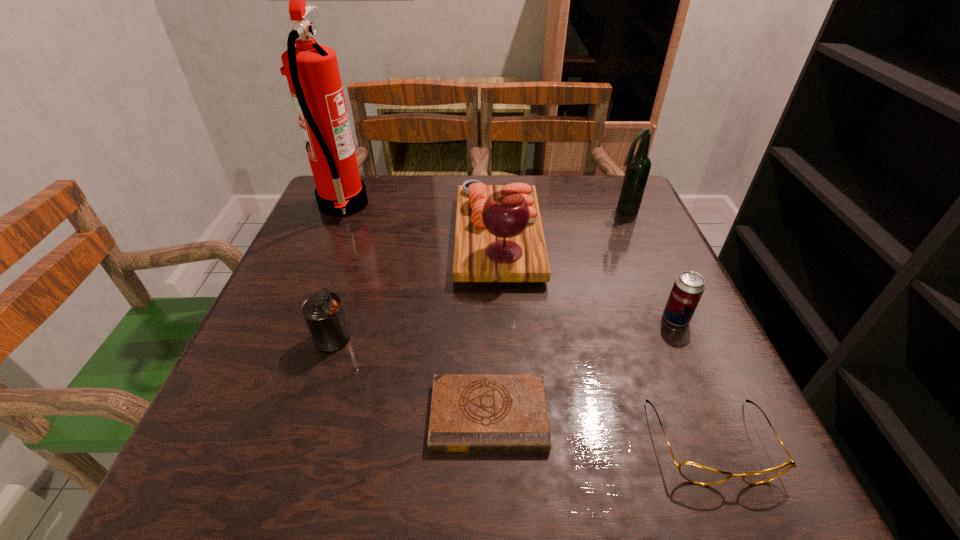
Select which object is the closest to the shortest object. Please provide its 2D coordinates. Your answer should be formatted as a tuple, i.e. [(x, y)], where the tuple contains the x and y coordinates of a point satisfying the conditions above.

[(693, 472)]

At what (x,y) coordinates should I click in order to perform the action: click on free location that satisfies the following two spatial constraints: 1. on the back side of the beer can; 2. on the left side of the can. Please return your answer as a coordinate pair (x, y). The height and width of the screenshot is (540, 960). Looking at the image, I should click on (339, 318).

You are a GUI agent. You are given a task and a screenshot of the screen. Output one action in this format:
    pyautogui.click(x=<x>, y=<y>)
    Task: Click on the free spot that satisfies the following two spatial constraints: 1. with the nozzle aimed from the tallest object; 2. on the back side of the platter
    This screenshot has height=540, width=960.
    Given the screenshot: What is the action you would take?
    pyautogui.click(x=329, y=238)

Find the location of a particular element. This screenshot has width=960, height=540. vacant area that satisfies the following two spatial constraints: 1. with the nozzle aimed from the sixth shortest object; 2. on the left side of the fire extinguisher is located at coordinates (342, 209).